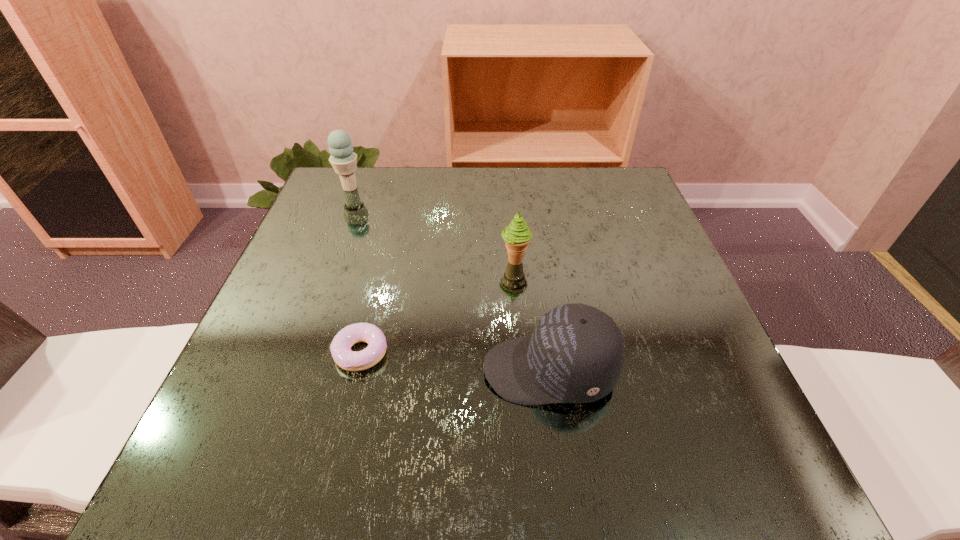
This screenshot has height=540, width=960. Identify the location of free spot between the baseball cap and the tallest object. (450, 279).

You are a GUI agent. You are given a task and a screenshot of the screen. Output one action in this format:
    pyautogui.click(x=<x>, y=<y>)
    Task: Click on the vacant area that lies between the shorter icecream and the baseball cap
    The height and width of the screenshot is (540, 960).
    Given the screenshot: What is the action you would take?
    pyautogui.click(x=532, y=315)

The width and height of the screenshot is (960, 540). Identify the location of empty space between the tallest object and the nearer icecream. (432, 224).

At what (x,y) coordinates should I click in order to perform the action: click on free space between the left icecream and the nearer icecream. Please return your answer as a coordinate pair (x, y). The height and width of the screenshot is (540, 960). Looking at the image, I should click on (432, 224).

Identify which object is the second closest to the third object from right to left. Please provide its 2D coordinates. Your answer should be formatted as a tuple, i.e. [(x, y)], where the tuple contains the x and y coordinates of a point satisfying the conditions above.

[(517, 235)]

Select which object is the closest to the doughnut. Please provide its 2D coordinates. Your answer should be formatted as a tuple, i.e. [(x, y)], where the tuple contains the x and y coordinates of a point satisfying the conditions above.

[(575, 354)]

Image resolution: width=960 pixels, height=540 pixels. Find the location of `vacant space that satisfies the following two spatial constraints: 1. on the back side of the doughnut; 2. on the right side of the shorter icecream`. vacant space that satisfies the following two spatial constraints: 1. on the back side of the doughnut; 2. on the right side of the shorter icecream is located at coordinates (383, 260).